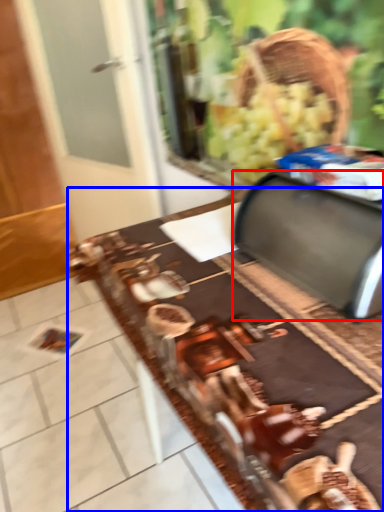
Question: Which of the following is the farthest to the observer, wide (highlighted by a red box) or table (highlighted by a blue box)?

Choices:
 (A) wide
 (B) table

Answer: (A)